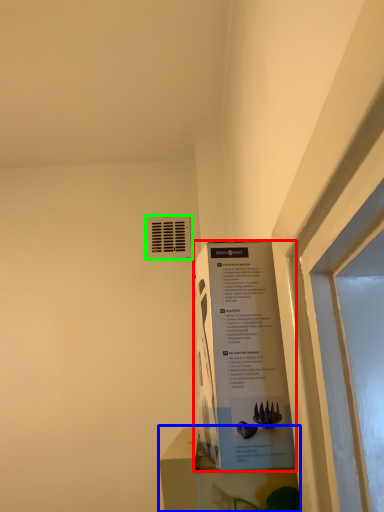
Question: Estimate the real-world distances between objects in this image. Which object is closer to poster (highlighted by a red box), window sill (highlighted by a blue box) or air conditioning (highlighted by a green box)?

Choices:
 (A) window sill
 (B) air conditioning

Answer: (A)